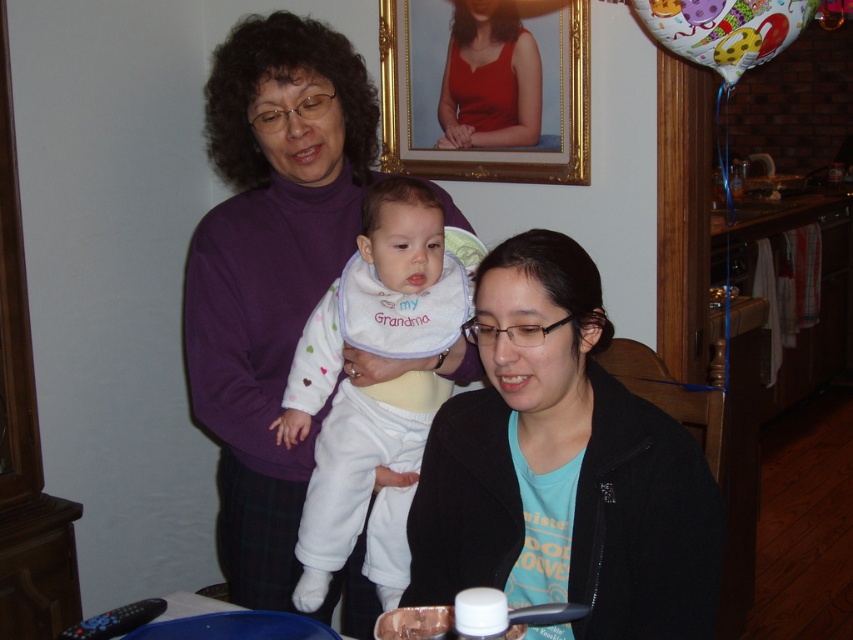
Can you confirm if black matte jacket at center is positioned to the right of gold-framed portrait at upper center?

Yes, black matte jacket at center is to the right of gold-framed portrait at upper center.

What do you see at coordinates (561, 467) in the screenshot? I see `black matte jacket at center` at bounding box center [561, 467].

What do you see at coordinates (561, 467) in the screenshot?
I see `black matte jacket at center` at bounding box center [561, 467].

The width and height of the screenshot is (853, 640). Identify the location of black matte jacket at center. (561, 467).

How much distance is there between black matte jacket at center and white fleece bib at center?

black matte jacket at center and white fleece bib at center are 10.95 inches apart.

Can you confirm if black matte jacket at center is positioned to the left of white fleece bib at center?

Incorrect, black matte jacket at center is not on the left side of white fleece bib at center.

This screenshot has height=640, width=853. Describe the element at coordinates (561, 467) in the screenshot. I see `black matte jacket at center` at that location.

Identify the location of black matte jacket at center. This screenshot has width=853, height=640. (561, 467).

What do you see at coordinates (380, 298) in the screenshot? This screenshot has width=853, height=640. I see `white fleece bib at center` at bounding box center [380, 298].

Which is below, white fleece bib at center or gold-framed portrait at upper center?

Positioned lower is white fleece bib at center.

Is point (457, 296) less distant than point (527, 172)?

Yes, point (457, 296) is closer to viewer.

You are a GUI agent. You are given a task and a screenshot of the screen. Output one action in this format:
    pyautogui.click(x=<x>, y=<y>)
    Task: Click on the white fleece bib at center
    
    Given the screenshot: What is the action you would take?
    pyautogui.click(x=380, y=298)